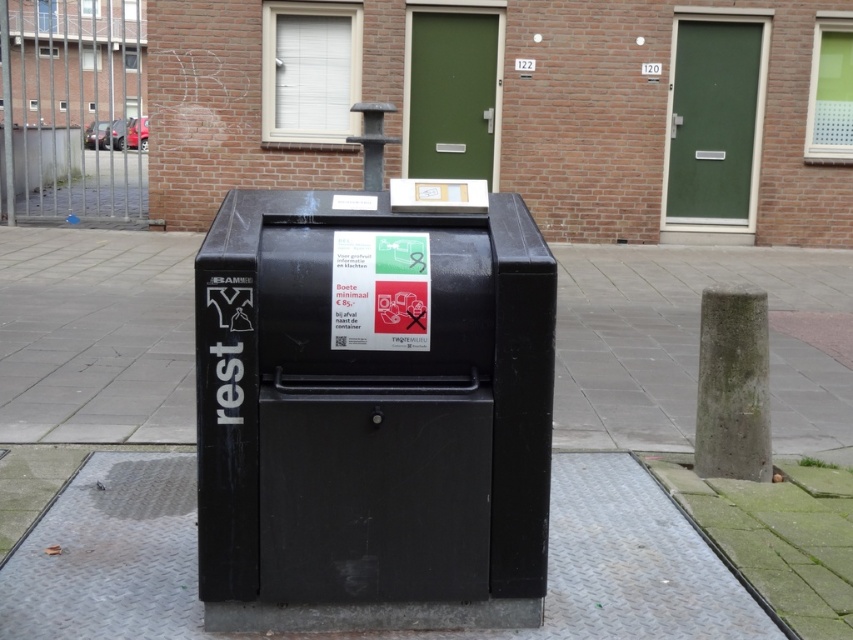
Who is positioned more to the left, black matte mailbox at center or metallic gray pavement at lower center?

black matte mailbox at center

Which is below, black matte mailbox at center or metallic gray pavement at lower center?

metallic gray pavement at lower center is below.

Who is more forward, (384, 614) or (569, 500)?

Point (384, 614)

Identify the location of black matte mailbox at center. (372, 410).